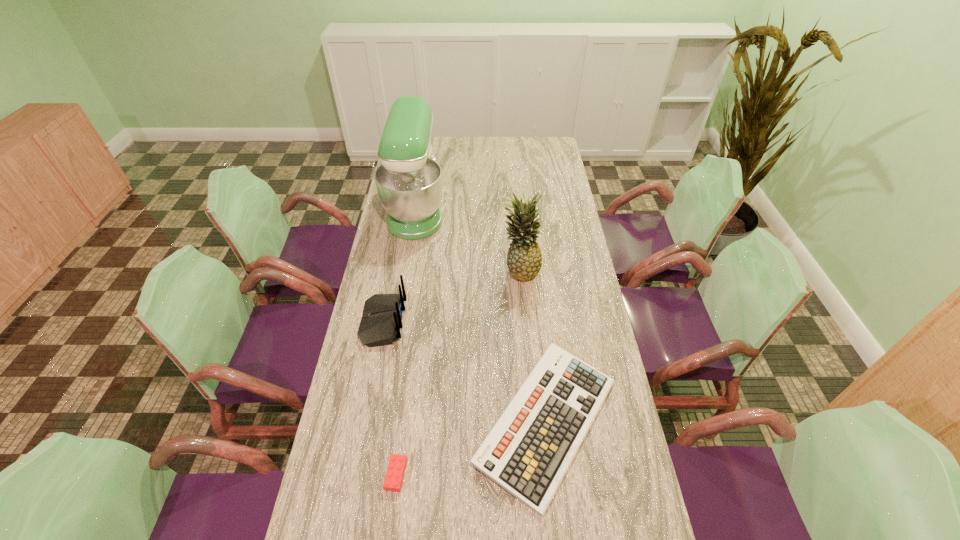
Point out which object is positioned as the fourth nearest to the third tallest object. Please provide its 2D coordinates. Your answer should be formatted as a tuple, i.e. [(x, y)], where the tuple contains the x and y coordinates of a point satisfying the conditions above.

[(394, 477)]

Locate an element on the screen. the third closest object to the shortest object is located at coordinates (524, 259).

At what (x,y) coordinates should I click in order to perform the action: click on vacant space that satisfies the following two spatial constraints: 1. on the back side of the fourth nearest object; 2. on the controls of the tallest object. Please return your answer as a coordinate pair (x, y). Looking at the image, I should click on (514, 210).

Locate an element on the screen. This screenshot has height=540, width=960. vacant space that satisfies the following two spatial constraints: 1. on the back of the third shortest object; 2. on the left side of the shortest object is located at coordinates (354, 475).

Locate an element on the screen. blank space that satisfies the following two spatial constraints: 1. on the controls of the pineapple; 2. on the left side of the mixer is located at coordinates (407, 270).

I want to click on free spot that satisfies the following two spatial constraints: 1. on the back side of the fourth tallest object; 2. on the left side of the Lego, so click(x=403, y=422).

Find the location of a particular element. This screenshot has height=540, width=960. vacant point that satisfies the following two spatial constraints: 1. on the back side of the computer keyboard; 2. on the left side of the Lego is located at coordinates (403, 422).

Where is `vacant space that satisfies the following two spatial constraints: 1. on the controls of the tallest object; 2. on the right side of the shortest object`? vacant space that satisfies the following two spatial constraints: 1. on the controls of the tallest object; 2. on the right side of the shortest object is located at coordinates (373, 475).

Image resolution: width=960 pixels, height=540 pixels. Identify the location of vacant area in the image that satisfies the following two spatial constraints: 1. on the back of the router; 2. on the left side of the second shortest object. (364, 422).

Image resolution: width=960 pixels, height=540 pixels. Identify the location of vacant space that satisfies the following two spatial constraints: 1. on the controls of the Lego; 2. on the right side of the tallest object. (373, 475).